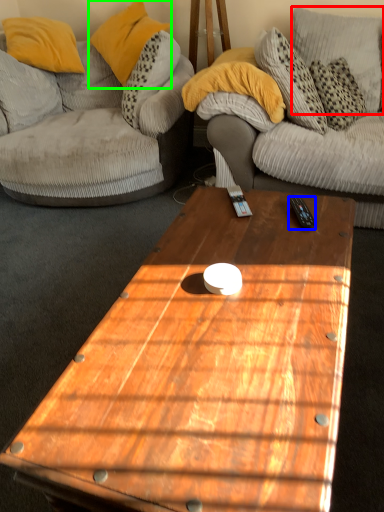
Question: Which object is the closest to the pillow (highlighted by a red box)? Choose among these: remote control (highlighted by a blue box) or pillow (highlighted by a green box).

Choices:
 (A) remote control
 (B) pillow

Answer: (B)